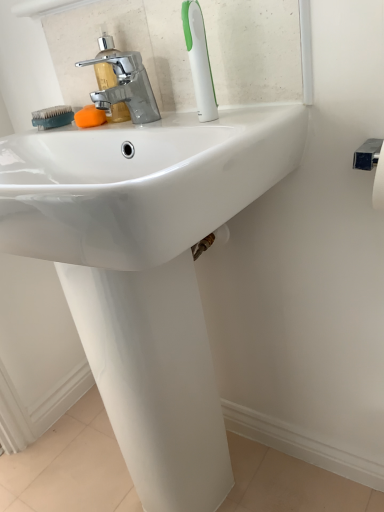
Question: Are chrome metallic faucet at upper left and white plastic toothbrush at upper center beside each other?

Choices:
 (A) yes
 (B) no

Answer: (B)

Question: Is chrome metallic faucet at upper left facing away from white plastic toothbrush at upper center?

Choices:
 (A) no
 (B) yes

Answer: (A)

Question: Does chrome metallic faucet at upper left have a smaller size compared to white plastic toothbrush at upper center?

Choices:
 (A) no
 (B) yes

Answer: (A)

Question: Can you confirm if chrome metallic faucet at upper left is shorter than white plastic toothbrush at upper center?

Choices:
 (A) no
 (B) yes

Answer: (B)

Question: Is chrome metallic faucet at upper left taller than white plastic toothbrush at upper center?

Choices:
 (A) yes
 (B) no

Answer: (B)

Question: Does point (200, 65) appear closer or farther from the camera than point (43, 112)?

Choices:
 (A) closer
 (B) farther

Answer: (A)

Question: Considering the relative positions of white plastic toothbrush at upper center and teal rubber brush at left in the image provided, is white plastic toothbrush at upper center to the left or to the right of teal rubber brush at left?

Choices:
 (A) left
 (B) right

Answer: (B)

Question: Looking at their shapes, would you say white plastic toothbrush at upper center is wider or thinner than teal rubber brush at left?

Choices:
 (A) wide
 (B) thin

Answer: (B)

Question: Looking at the image, does white plastic toothbrush at upper center seem bigger or smaller compared to teal rubber brush at left?

Choices:
 (A) big
 (B) small

Answer: (A)

Question: Would you say teal rubber brush at left is inside or outside chrome metallic faucet at upper left?

Choices:
 (A) inside
 (B) outside

Answer: (B)

Question: From their relative heights in the image, would you say teal rubber brush at left is taller or shorter than chrome metallic faucet at upper left?

Choices:
 (A) tall
 (B) short

Answer: (B)

Question: Considering the positions of teal rubber brush at left and chrome metallic faucet at upper left in the image, is teal rubber brush at left wider or thinner than chrome metallic faucet at upper left?

Choices:
 (A) thin
 (B) wide

Answer: (B)

Question: In the image, is teal rubber brush at left positioned in front of or behind chrome metallic faucet at upper left?

Choices:
 (A) front
 (B) behind

Answer: (B)

Question: From the image's perspective, is orange sponge at center above or below chrome metallic faucet at upper left?

Choices:
 (A) below
 (B) above

Answer: (A)

Question: From their relative heights in the image, would you say orange sponge at center is taller or shorter than chrome metallic faucet at upper left?

Choices:
 (A) tall
 (B) short

Answer: (B)